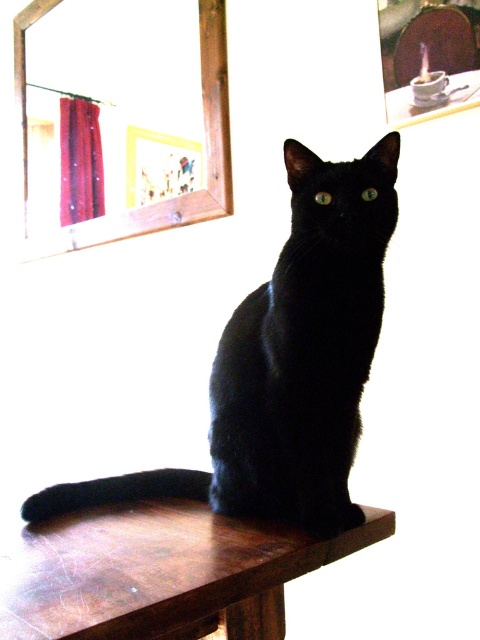
You are a photographer setting up a shoot in this scene. You want to place a small prop between the black glossy cat at center and the wooden table at center. Is the space between them sufficient to fit the prop?

The wooden table at center is behind the black glossy cat at center, so there is no space between them. The prop cannot be placed between them.

You are standing in front of the chair where the black glossy cat at center is sitting. If you want to place a small bowl of water for the cat, where should you position it relative to the cat to ensure it is easily accessible?

The black glossy cat at center is located at point (287, 364), so placing the bowl slightly to the left or right of the cat would ensure easy access while keeping it within reach.

You are a photographer setting up a studio. You have a black glossy cat at center and a wooden table at center in your frame. The camera you are using has a height adjustment feature. To ensure both subjects are in focus, you need to know which one is taller. Can you determine which is taller?

The black glossy cat at center is taller than the wooden table at center, so you should adjust the camera height to focus on the black glossy cat at center first to ensure both are in focus.